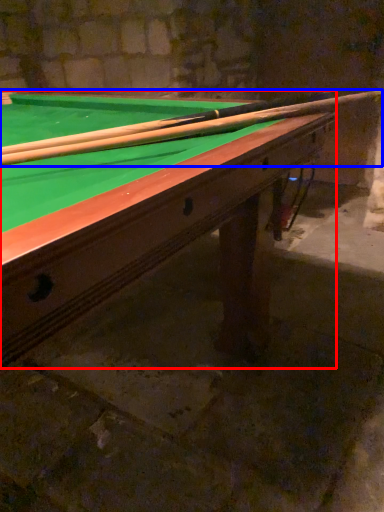
Question: Which point is closer to the camera, billiard table (highlighted by a red box) or cue (highlighted by a blue box)?

Choices:
 (A) billiard table
 (B) cue

Answer: (A)